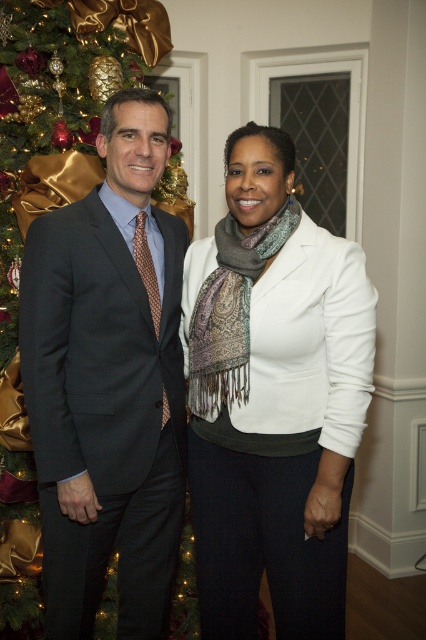
Consider the image. Does matte black suit at center have a lesser height compared to dark gray suit at left?

Correct, matte black suit at center is not as tall as dark gray suit at left.

Does matte black suit at center appear under dark gray suit at left?

No, matte black suit at center is not below dark gray suit at left.

Which is in front, point (178, 346) or point (78, 424)?

Positioned in front is point (78, 424).

The height and width of the screenshot is (640, 426). I want to click on matte black suit at center, so click(108, 381).